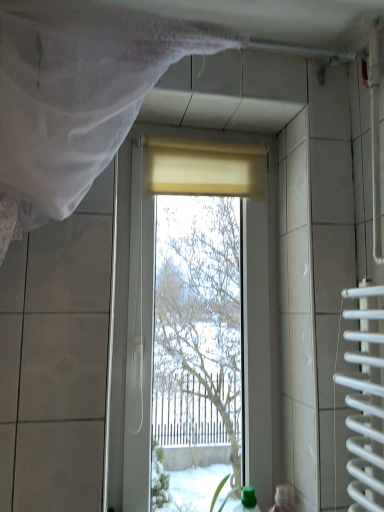
What do you see at coordinates (77, 96) in the screenshot? I see `white sheer curtain at upper left` at bounding box center [77, 96].

Measure the distance between white sheer curtain at upper left and camera.

The depth of white sheer curtain at upper left is 33.36 inches.

At what (x,y) coordinates should I click in order to perform the action: click on white sheer curtain at upper left. Please return your answer as a coordinate pair (x, y). Looking at the image, I should click on (77, 96).

Locate an element on the screen. Image resolution: width=384 pixels, height=512 pixels. white sheer curtain at upper left is located at coordinates (77, 96).